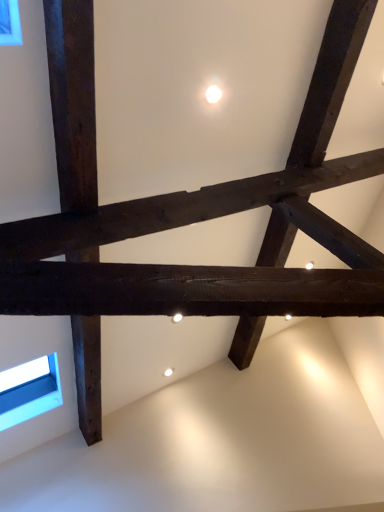
Question: Should I look upward or downward to see blue glass window at lower left?

Choices:
 (A) down
 (B) up

Answer: (A)